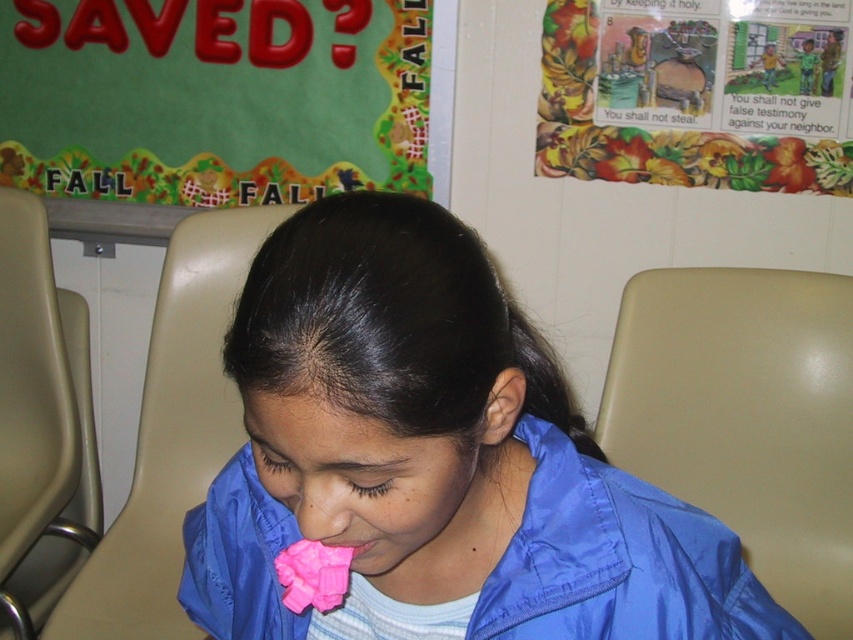
How far apart are beige plastic chair at center and pink matte nose at center?

beige plastic chair at center is 3.46 feet from pink matte nose at center.

Does beige plastic chair at center lie behind pink matte nose at center?

That is True.

Does point (216, 356) come in front of point (328, 529)?

No, (216, 356) is further to viewer.

Identify the location of beige plastic chair at center. (171, 435).

Is beige plastic chair at lower left taller than pink matte nose at center?

Yes.

How far apart are beige plastic chair at lower left and pink matte nose at center?

The distance of beige plastic chair at lower left from pink matte nose at center is 4.01 feet.

Based on the photo, who is more forward, (15, 419) or (294, 506)?

Positioned in front is point (294, 506).

Find the location of `beige plastic chair at lower left`. beige plastic chair at lower left is located at coordinates (38, 412).

Measure the distance from pink matte paper at center to beige plastic chair at lower left.

97.30 centimeters

Does pink matte paper at center appear over beige plastic chair at lower left?

Yes.

This screenshot has height=640, width=853. What are the coordinates of `pink matte paper at center` in the screenshot? It's located at (440, 454).